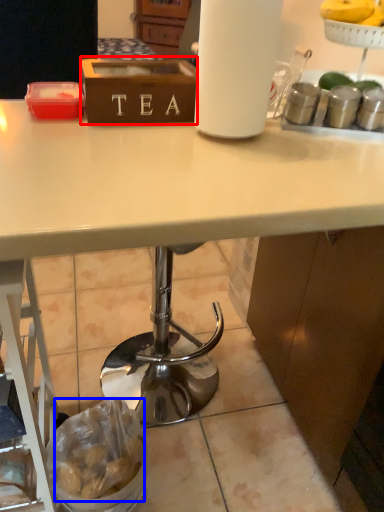
Question: Which point is further to the camera, box (highlighted by a red box) or food (highlighted by a blue box)?

Choices:
 (A) box
 (B) food

Answer: (B)